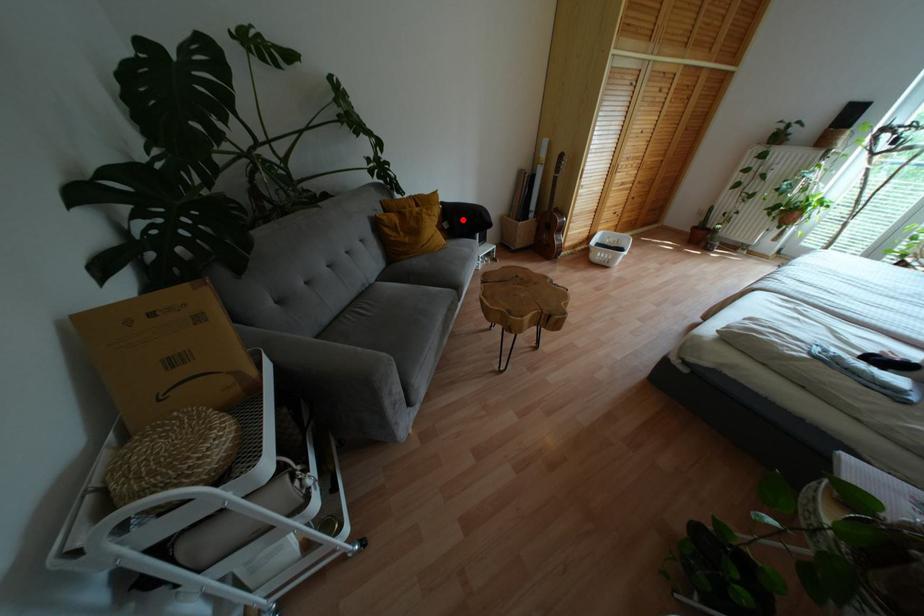
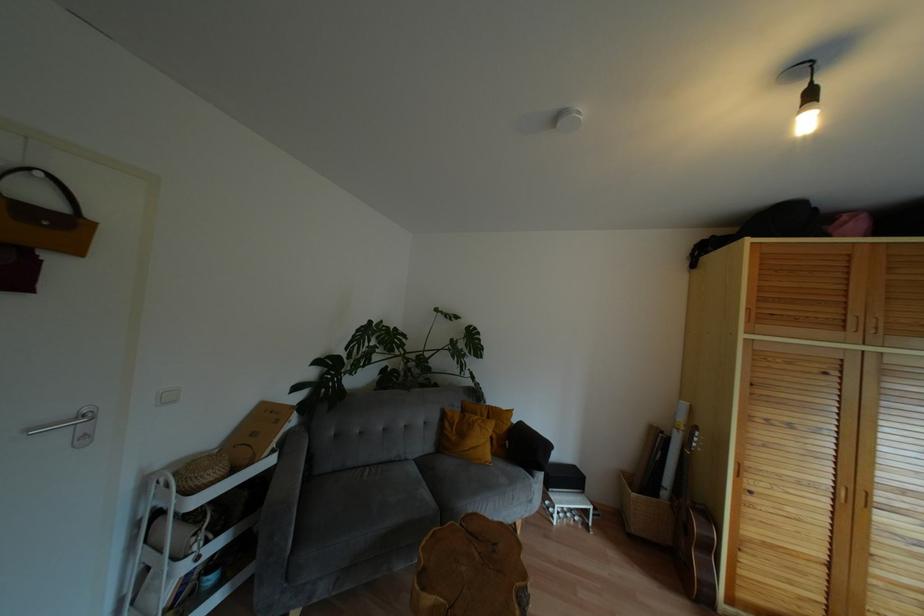
Question: A red point is marked in image1. In image2, is the corresponding 3D point closer to the camera or farther? Reply with the corresponding letter.

Choices:
 (A) The corresponding 3D point is closer.
 (B) The corresponding 3D point is farther.

Answer: (B)